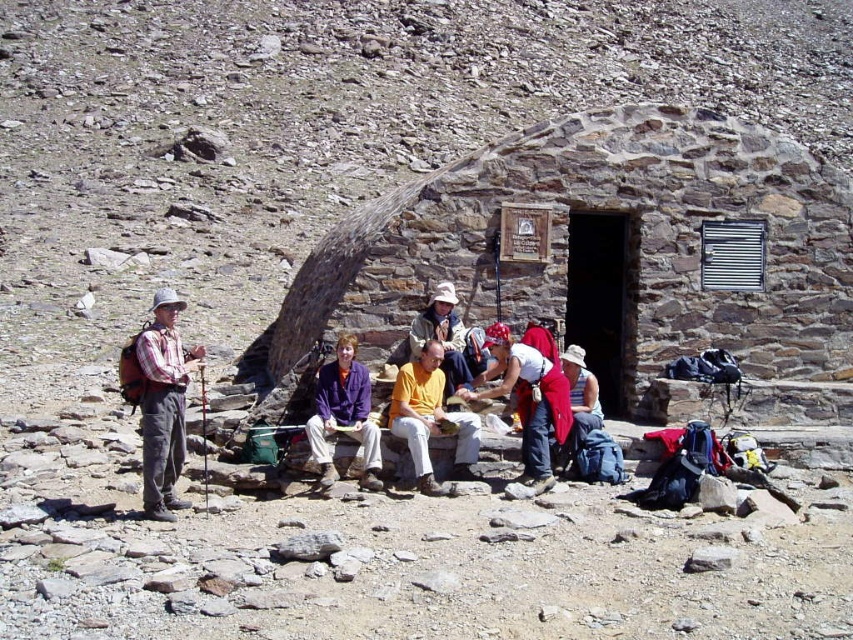
You are a hiker trying to locate your friend who is wearing a matte yellow shirt at center. You are currently wearing a purple fleece jacket at center. How far apart are you from your friend?

The purple fleece jacket at center and matte yellow shirt at center are 3.26 meters apart, so you are 3.26 meters away from your friend.

You are a hiker who has reached the stone textured hut at center. You notice your purple fleece jacket at center nearby. Which object is positioned higher in elevation?

The stone textured hut at center is positioned higher in elevation than the purple fleece jacket at center according to the description.